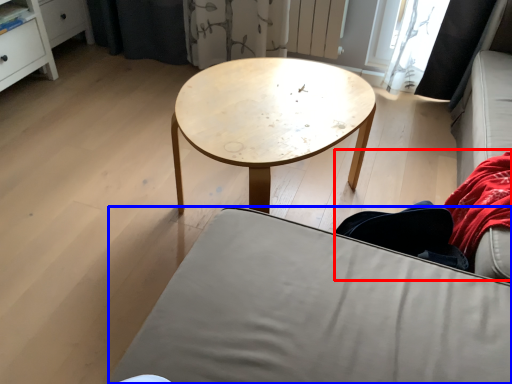
Question: Among these objects, which one is nearest to the camera, couple (highlighted by a red box) or studio couch (highlighted by a blue box)?

Choices:
 (A) couple
 (B) studio couch

Answer: (B)